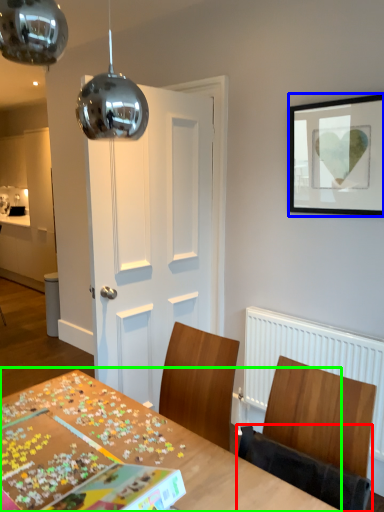
Question: Which is farther away from chair (highlighted by a red box)? picture frame (highlighted by a blue box) or table (highlighted by a green box)?

Choices:
 (A) picture frame
 (B) table

Answer: (A)